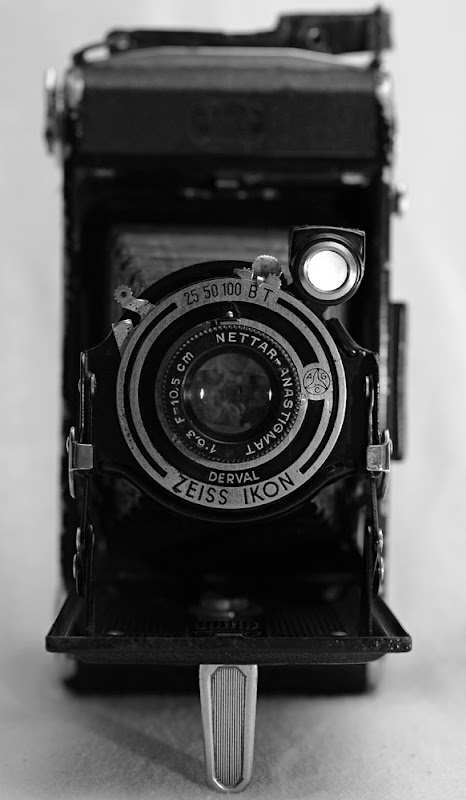
Locate an element on the screen. shutter is located at coordinates (183, 368).